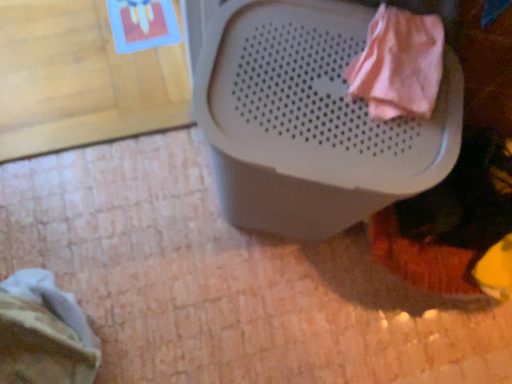
Question: Does point (284, 213) appear closer or farther from the camera than point (68, 317)?

Choices:
 (A) farther
 (B) closer

Answer: (B)

Question: Is white plastic waste container at upper center wider or thinner than striped fabric at lower left, which is the second clothing from right to left?

Choices:
 (A) wide
 (B) thin

Answer: (A)

Question: Estimate the real-world distances between objects in this image. Which object is closer to the white plastic waste container at upper center?

Choices:
 (A) striped fabric at lower left, positioned as the 2th clothing in front-to-back order
 (B) pink fabric at upper right, marked as the first clothing in a front-to-back arrangement

Answer: (B)

Question: Which object is positioned farthest from the white plastic waste container at upper center?

Choices:
 (A) pink fabric at upper right, the second clothing viewed from the left
 (B) striped fabric at lower left, which is the second clothing from right to left

Answer: (B)